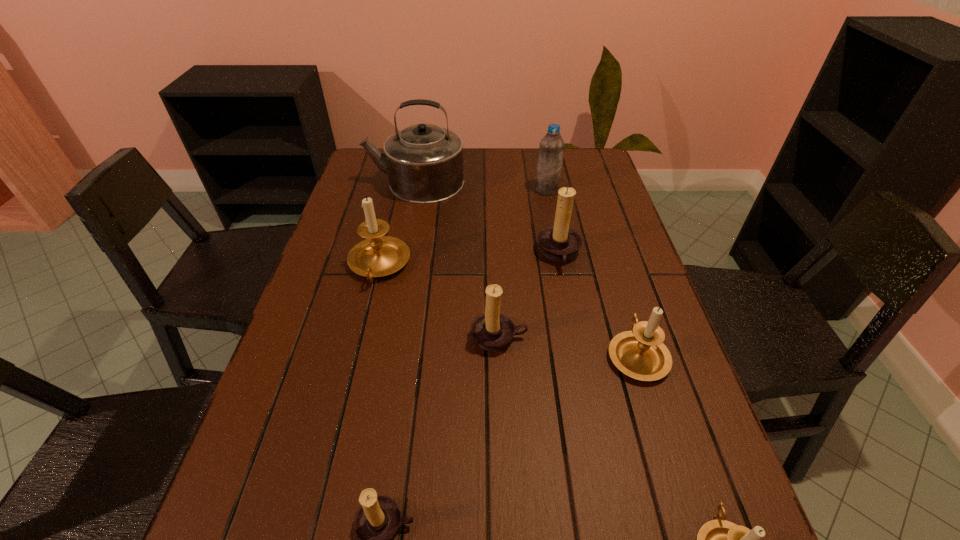
Identify which beige candle holder is the third closest to the tallest object. Please provide its 2D coordinates. Your answer should be formatted as a tuple, i.e. [(x, y)], where the tuple contains the x and y coordinates of a point satisfying the conditions above.

[(718, 539)]

I want to click on beige candle holder that is the second closest to the farthest brown candle holder, so click(x=377, y=256).

Find the location of a particular element. This screenshot has width=960, height=540. vacant area in the image that satisfies the following two spatial constraints: 1. with the spout at the front of the kettle; 2. with a handle on the side of the second smallest beige candle holder is located at coordinates (381, 355).

Where is `free spot that satisfies the following two spatial constraints: 1. on the wick of the biggest brown candle holder; 2. with a handle on the side of the farthest beige candle holder`? This screenshot has width=960, height=540. free spot that satisfies the following two spatial constraints: 1. on the wick of the biggest brown candle holder; 2. with a handle on the side of the farthest beige candle holder is located at coordinates (561, 265).

Where is `free space that satisfies the following two spatial constraints: 1. with the spout at the front of the kettle; 2. on the left side of the water bottle`? The width and height of the screenshot is (960, 540). free space that satisfies the following two spatial constraints: 1. with the spout at the front of the kettle; 2. on the left side of the water bottle is located at coordinates (414, 190).